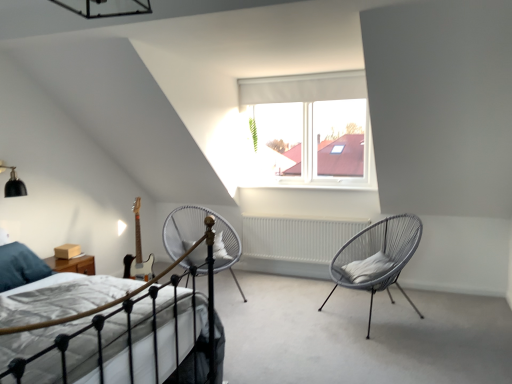
Question: From the image's perspective, is white fabric bed at lower left positioned above or below silver metallic chair at center, placed as the second chair when sorted from right to left?

Choices:
 (A) above
 (B) below

Answer: (B)

Question: Considering the positions of point (153, 364) and point (238, 241), is point (153, 364) closer or farther from the camera than point (238, 241)?

Choices:
 (A) closer
 (B) farther

Answer: (A)

Question: Estimate the real-world distances between objects in this image. Which object is closer to the white matte radiator at center?

Choices:
 (A) silver metallic chair at center, placed as the second chair when sorted from right to left
 (B) black matte light fixture at upper left
 (C) white soft pillow at right
 (D) white fabric bed at lower left
 (E) gray woven chair at right, which is counted as the 2th chair, starting from the left

Answer: (E)

Question: Which of these objects is positioned closest to the white soft pillow at right?

Choices:
 (A) white matte radiator at center
 (B) black matte light fixture at upper left
 (C) gray woven chair at right, which is counted as the 2th chair, starting from the left
 (D) white fabric curtain at upper center
 (E) silver metallic chair at center, which is counted as the 1th chair, starting from the left

Answer: (C)